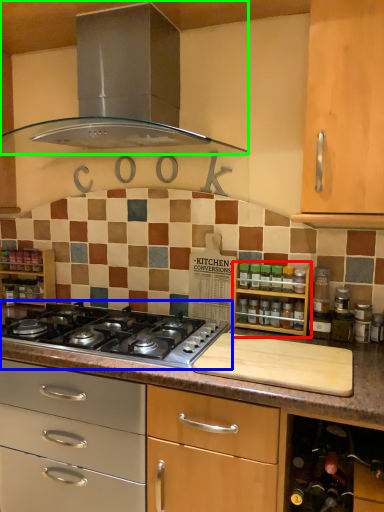
Question: Based on their relative distances, which object is nearer to shelf (highlighted by a red box)? Choose from gas stove (highlighted by a blue box) and home appliance (highlighted by a green box).

Choices:
 (A) gas stove
 (B) home appliance

Answer: (A)